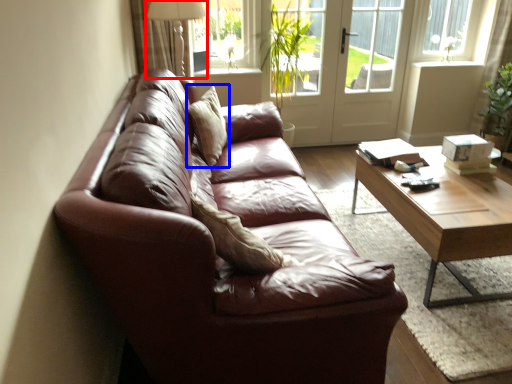
Question: Which point is closer to the camera, table lamp (highlighted by a red box) or pillow (highlighted by a blue box)?

Choices:
 (A) table lamp
 (B) pillow

Answer: (B)